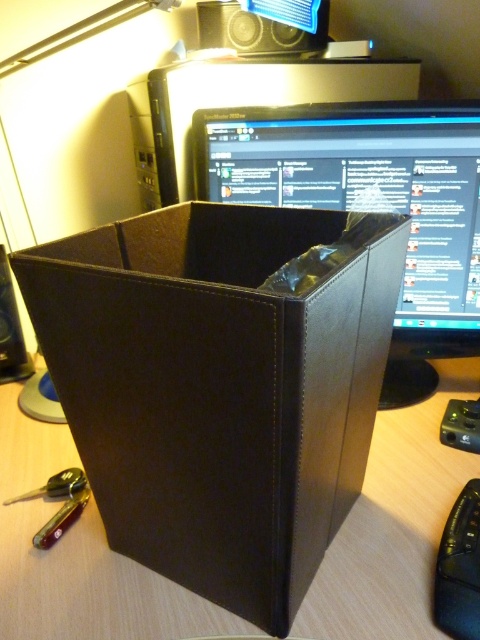
You are setting up a new desk and want to place the black plastic mouse at lower right and the black leather speaker at left. If the desk space between them is 15 cm, will they fit without overlapping?

The black plastic mouse at lower right might be wider than the black leather speaker at left, but since the desk space between them is 15 cm, it depends on their combined widths. If their total width is less than or equal to 15 cm, they can fit without overlapping.

You are setting up a new speaker in your workspace. The black plastic speaker at upper center is placed at coordinates point 0.048, 0.535. If you want to place a new speaker exactly 0.05 units to the right of the existing one, what would be the new coordinates?

The new coordinates would be approximately (256, 64) because adding 0.05 to the x coordinate of the black plastic speaker at upper center at 0.048 gives 0.098, which rounds to 0.10, while the y coordinate remains unchanged.

You are organizing your desk and want to move the black plastic mouse at lower right closer to the black leather speaker at left. Based on their current positions, which object is closer to you?

The black plastic mouse at lower right is closer to you since it is in front of the black leather speaker at left.